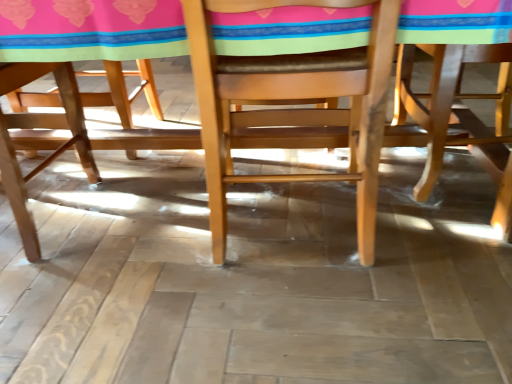
Question: From a real-world perspective, is light brown wood chair at right, marked as the 2th chair in a left-to-right arrangement, above or below natural wood chair at center, the second chair viewed from the right?

Choices:
 (A) below
 (B) above

Answer: (A)

Question: Is light brown wood chair at right, marked as the 2th chair in a left-to-right arrangement, inside or outside of natural wood chair at center, the 1th chair in the left-to-right sequence?

Choices:
 (A) inside
 (B) outside

Answer: (B)

Question: Which is farther from the wooden table at center?

Choices:
 (A) light brown wood chair at right, marked as the 2th chair in a left-to-right arrangement
 (B) natural wood chair at center, the 1th chair in the left-to-right sequence

Answer: (A)

Question: Which is nearer to the light brown wood chair at right, marked as the first chair in a right-to-left arrangement?

Choices:
 (A) natural wood chair at center, the 1th chair in the left-to-right sequence
 (B) wooden table at center

Answer: (B)